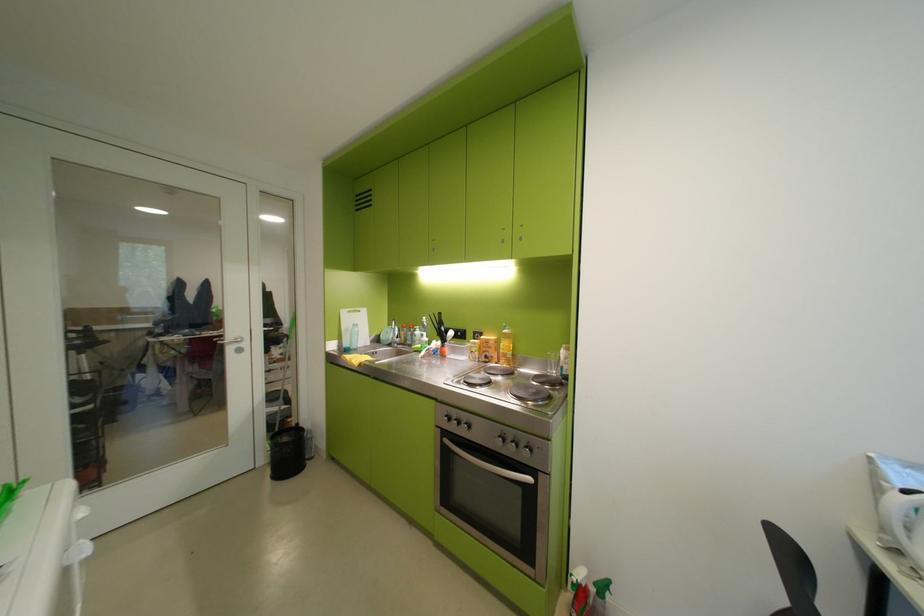
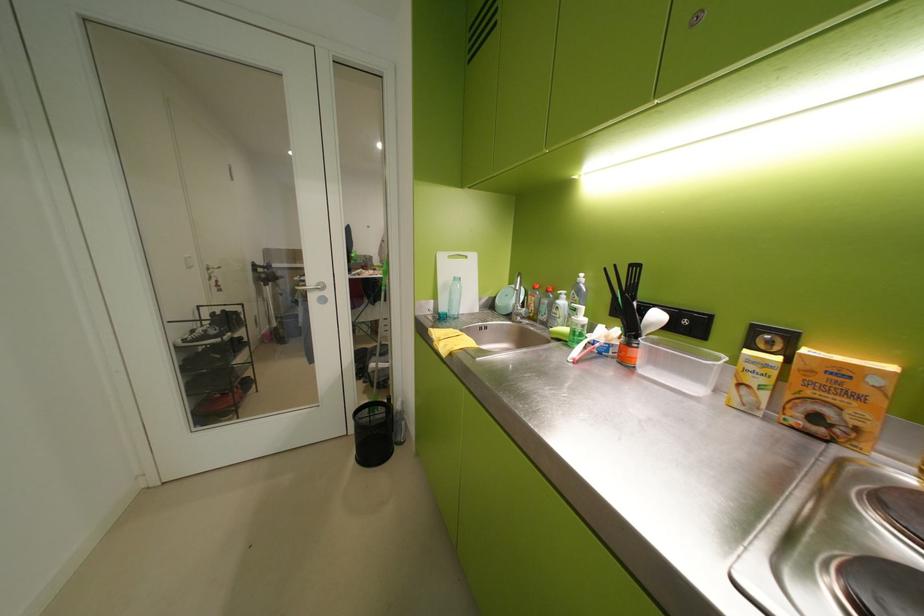
Locate, in the second image, the point that corresponds to point 485,344 in the first image.

(773, 365)